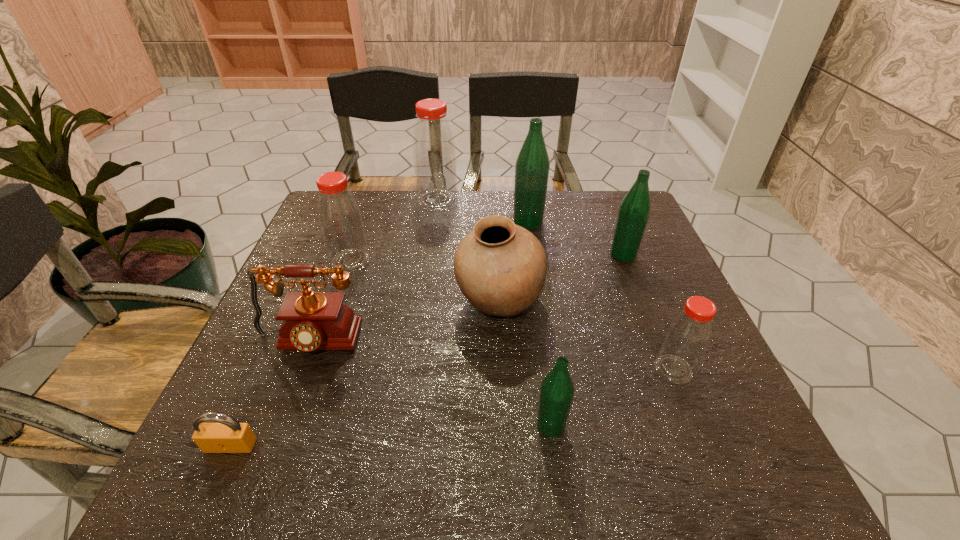
The height and width of the screenshot is (540, 960). I want to click on the second red bottle from right to left, so click(434, 155).

The height and width of the screenshot is (540, 960). Identify the location of the sixth object from right to left. (434, 155).

I want to click on the second farthest object, so (x=532, y=166).

At what (x,y) coordinates should I click in order to perform the action: click on the farthest green bottle. Please return your answer as a coordinate pair (x, y). Looking at the image, I should click on (532, 166).

You are a GUI agent. You are given a task and a screenshot of the screen. Output one action in this format:
    pyautogui.click(x=<x>, y=<y>)
    Task: Click on the second smallest red bottle
    The height and width of the screenshot is (540, 960).
    Given the screenshot: What is the action you would take?
    pos(341,223)

This screenshot has height=540, width=960. What are the coordinates of `the second farthest red bottle` in the screenshot? It's located at 341,223.

The height and width of the screenshot is (540, 960). What are the coordinates of `the rightmost green bottle` in the screenshot? It's located at (635, 208).

Where is `the second smallest green bottle`? The image size is (960, 540). the second smallest green bottle is located at coordinates (635, 208).

At what (x,y) coordinates should I click in order to perform the action: click on pottery. Please return your answer as a coordinate pair (x, y). Looking at the image, I should click on (500, 267).

Where is `telephone`? telephone is located at coordinates (312, 321).